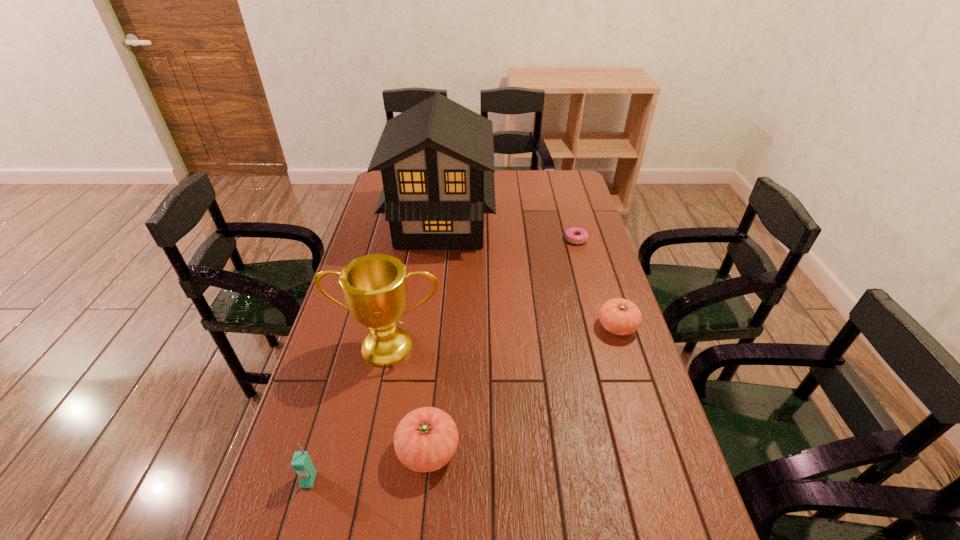
You are a GUI agent. You are given a task and a screenshot of the screen. Output one action in this format:
    pyautogui.click(x=<x>, y=<y>)
    Task: Click on the vacant region between the taller tomato and the award
    The image size is (960, 540).
    Given the screenshot: What is the action you would take?
    pyautogui.click(x=409, y=399)

Find the location of a particular element. The height and width of the screenshot is (540, 960). vacant space that is in between the left tomato and the dollhouse is located at coordinates (435, 338).

Locate an element on the screen. The width and height of the screenshot is (960, 540). object that can be found as the fifth closest to the doughnut is located at coordinates coord(301,463).

Identify which object is the third closest to the doughnut. Please provide its 2D coordinates. Your answer should be formatted as a tuple, i.e. [(x, y)], where the tuple contains the x and y coordinates of a point satisfying the conditions above.

[(374, 287)]

Locate an element on the screen. This screenshot has width=960, height=540. free space that satisfies the following two spatial constraints: 1. on the front-facing side of the tallest object; 2. on the right side of the doughnut is located at coordinates (440, 239).

At what (x,y) coordinates should I click in order to perform the action: click on free spot that satisfies the following two spatial constraints: 1. on the front-facing side of the tallest object; 2. on the right side of the doughnut. Please return your answer as a coordinate pair (x, y). This screenshot has width=960, height=540. Looking at the image, I should click on (440, 239).

I want to click on vacant position in the image that satisfies the following two spatial constraints: 1. on the shiny surface of the award; 2. on the left side of the nearer tomato, so click(x=369, y=450).